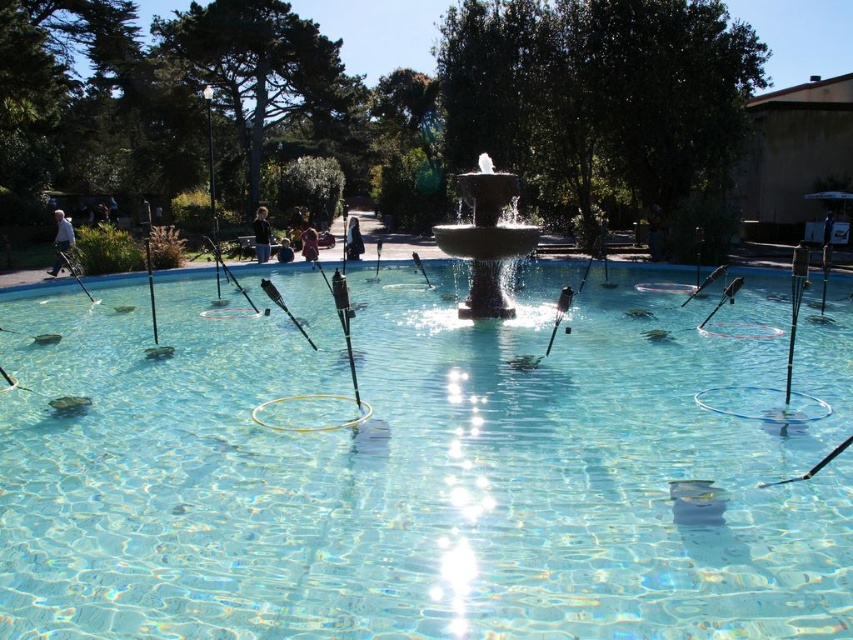
Question: Which of these objects is positioned closest to the light brown hair at center?

Choices:
 (A) white fabric person at left
 (B) clear glass swimming pool at center
 (C) polished stone fountain at center
 (D) dark brown leather jacket at center

Answer: (D)

Question: Can you confirm if dark brown leather jacket at center is positioned above dark blue jeans at center?

Choices:
 (A) no
 (B) yes

Answer: (B)

Question: Which point appears closest to the camera in this image?

Choices:
 (A) (494, 228)
 (B) (476, 339)
 (C) (67, 221)
 (D) (358, 237)

Answer: (B)

Question: Considering the relative positions of polished stone fountain at center and dark brown leather jacket at center in the image provided, where is polished stone fountain at center located with respect to dark brown leather jacket at center?

Choices:
 (A) right
 (B) left

Answer: (A)

Question: Is white fabric person at left thinner than light brown hair at center?

Choices:
 (A) yes
 (B) no

Answer: (B)

Question: Which point is closer to the camera?

Choices:
 (A) (474, 317)
 (B) (389, 336)
 (C) (55, 269)
 (D) (350, 250)

Answer: (B)